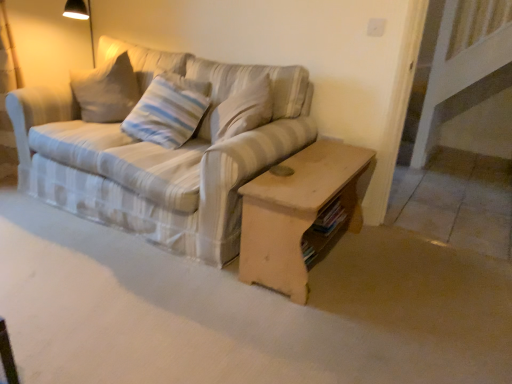
Question: From the image's perspective, is striped fabric couch at center beneath striped fabric pillow at center?

Choices:
 (A) no
 (B) yes

Answer: (B)

Question: Can we say striped fabric couch at center lies outside striped fabric pillow at center?

Choices:
 (A) no
 (B) yes

Answer: (B)

Question: Is striped fabric couch at center to the left of striped fabric pillow at center from the viewer's perspective?

Choices:
 (A) no
 (B) yes

Answer: (B)

Question: Is striped fabric couch at center not near striped fabric pillow at center?

Choices:
 (A) no
 (B) yes

Answer: (A)

Question: Could you tell me if striped fabric couch at center is turned towards striped fabric pillow at center?

Choices:
 (A) no
 (B) yes

Answer: (B)

Question: From a real-world perspective, is wooden coffee table at center above or below striped fabric couch at center?

Choices:
 (A) above
 (B) below

Answer: (B)

Question: Do you think wooden coffee table at center is within striped fabric couch at center, or outside of it?

Choices:
 (A) inside
 (B) outside

Answer: (B)

Question: Considering the relative positions of wooden coffee table at center and striped fabric couch at center in the image provided, is wooden coffee table at center to the left or to the right of striped fabric couch at center?

Choices:
 (A) right
 (B) left

Answer: (A)

Question: Is wooden coffee table at center in front of or behind striped fabric couch at center in the image?

Choices:
 (A) behind
 (B) front

Answer: (A)

Question: From the image's perspective, is striped fabric pillow at center positioned above or below wooden coffee table at center?

Choices:
 (A) above
 (B) below

Answer: (A)

Question: Would you say striped fabric pillow at center is to the left or to the right of wooden coffee table at center in the picture?

Choices:
 (A) left
 (B) right

Answer: (A)

Question: Is striped fabric pillow at center wider or thinner than wooden coffee table at center?

Choices:
 (A) thin
 (B) wide

Answer: (A)

Question: Considering their positions, is striped fabric pillow at center located in front of or behind wooden coffee table at center?

Choices:
 (A) front
 (B) behind

Answer: (B)

Question: Is wooden coffee table at center to the left or to the right of striped fabric pillow at center in the image?

Choices:
 (A) right
 (B) left

Answer: (A)

Question: Considering the positions of wooden coffee table at center and striped fabric pillow at center in the image, is wooden coffee table at center bigger or smaller than striped fabric pillow at center?

Choices:
 (A) small
 (B) big

Answer: (B)